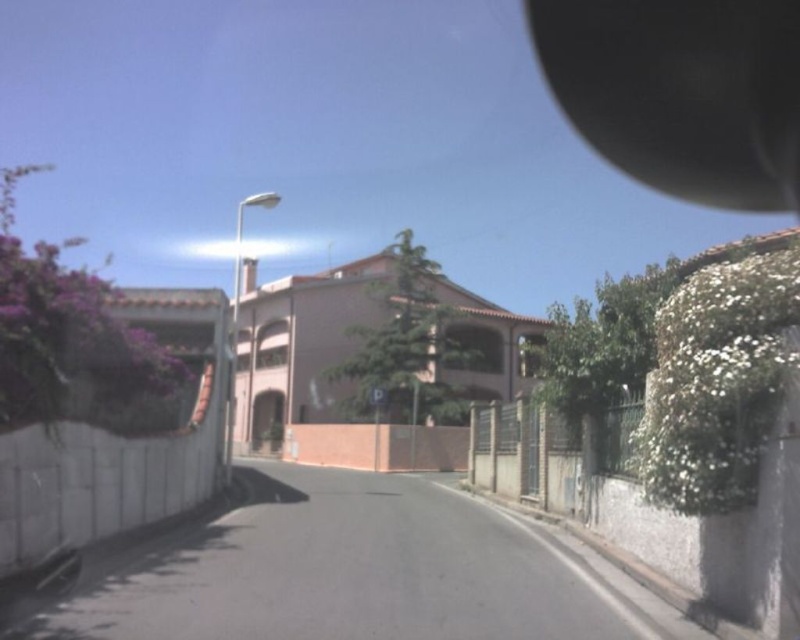
Which of these two, black matte view mirror at upper right or brick wall at center, stands shorter?

With less height is brick wall at center.

Is black matte view mirror at upper right below brick wall at center?

Incorrect, black matte view mirror at upper right is not positioned below brick wall at center.

Does point (574, 90) come in front of point (426, 456)?

No, (574, 90) is further to viewer.

Find the location of a particular element. The image size is (800, 640). black matte view mirror at upper right is located at coordinates (682, 92).

Who is higher up, black matte view mirror at upper right or metallic silver fence at right?

black matte view mirror at upper right is higher up.

Is point (684, 74) positioned after point (521, 428)?

Yes, point (684, 74) is behind point (521, 428).

Which is behind, point (712, 32) or point (554, 454)?

The point (712, 32) is more distant.

Identify the location of black matte view mirror at upper right. (682, 92).

Does metallic silver fence at right lie behind brick wall at center?

No, it is in front of brick wall at center.

Between point (532, 465) and point (306, 435), which one is positioned behind?

Positioned behind is point (306, 435).

Who is more forward, [608,428] or [342,456]?

Point [608,428]

You are a GUI agent. You are given a task and a screenshot of the screen. Output one action in this format:
    pyautogui.click(x=<x>, y=<y>)
    Task: Click on the metallic silver fence at right
    The height and width of the screenshot is (640, 800).
    Given the screenshot: What is the action you would take?
    pyautogui.click(x=545, y=454)